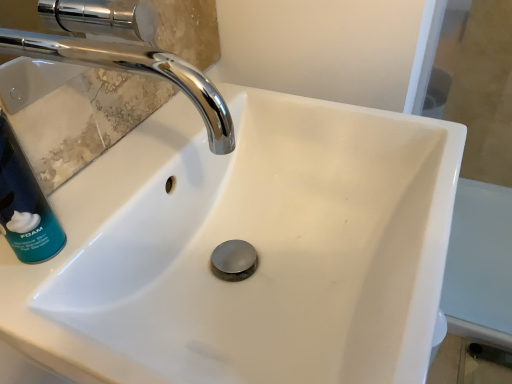
This screenshot has width=512, height=384. I want to click on teal matte shaving cream can at left, so click(x=25, y=205).

What do you see at coordinates (25, 205) in the screenshot? The image size is (512, 384). I see `teal matte shaving cream can at left` at bounding box center [25, 205].

The height and width of the screenshot is (384, 512). What do you see at coordinates (122, 53) in the screenshot?
I see `chrome/metallic faucet at upper left` at bounding box center [122, 53].

Where is `chrome/metallic faucet at upper left`? The height and width of the screenshot is (384, 512). chrome/metallic faucet at upper left is located at coordinates (122, 53).

What are the coordinates of `teal matte shaving cream can at left` in the screenshot? It's located at (25, 205).

Can you confirm if teal matte shaving cream can at left is positioned to the left of chrome/metallic faucet at upper left?

Indeed, teal matte shaving cream can at left is positioned on the left side of chrome/metallic faucet at upper left.

Considering the relative positions of teal matte shaving cream can at left and chrome/metallic faucet at upper left in the image provided, is teal matte shaving cream can at left in front of chrome/metallic faucet at upper left?

That is False.

Considering the points (11, 217) and (221, 122), which point is in front, point (11, 217) or point (221, 122)?

The point (11, 217) is closer to the camera.

From the image's perspective, which is above, teal matte shaving cream can at left or chrome/metallic faucet at upper left?

chrome/metallic faucet at upper left is shown above in the image.

From a real-world perspective, who is located higher, teal matte shaving cream can at left or chrome/metallic faucet at upper left?

chrome/metallic faucet at upper left, from a real-world perspective.

Considering the sizes of objects teal matte shaving cream can at left and chrome/metallic faucet at upper left in the image provided, who is thinner, teal matte shaving cream can at left or chrome/metallic faucet at upper left?

teal matte shaving cream can at left.

Can you confirm if teal matte shaving cream can at left is shorter than chrome/metallic faucet at upper left?

In fact, teal matte shaving cream can at left may be taller than chrome/metallic faucet at upper left.

Based on their sizes in the image, would you say teal matte shaving cream can at left is bigger or smaller than chrome/metallic faucet at upper left?

Clearly, teal matte shaving cream can at left is smaller in size than chrome/metallic faucet at upper left.

Does teal matte shaving cream can at left contain chrome/metallic faucet at upper left?

No, chrome/metallic faucet at upper left is not a part of teal matte shaving cream can at left.

Are teal matte shaving cream can at left and chrome/metallic faucet at upper left making contact?

No, teal matte shaving cream can at left is not with chrome/metallic faucet at upper left.

Is teal matte shaving cream can at left oriented away from chrome/metallic faucet at upper left?

teal matte shaving cream can at left is not turned away from chrome/metallic faucet at upper left.

Can you tell me how much teal matte shaving cream can at left and chrome/metallic faucet at upper left differ in facing direction?

The angle between the facing direction of teal matte shaving cream can at left and the facing direction of chrome/metallic faucet at upper left is 0.00787 degrees.

How much distance is there between teal matte shaving cream can at left and chrome/metallic faucet at upper left?

A distance of 15.31 inches exists between teal matte shaving cream can at left and chrome/metallic faucet at upper left.

Identify the location of tap above the teal matte shaving cream can at left (from a real-world perspective). This screenshot has width=512, height=384. (122, 53).

Between chrome/metallic faucet at upper left and teal matte shaving cream can at left, which one appears on the right side from the viewer's perspective?

chrome/metallic faucet at upper left.

Who is more distant, chrome/metallic faucet at upper left or teal matte shaving cream can at left?

teal matte shaving cream can at left is further away from the camera.

Considering the positions of points (87, 17) and (4, 143), is point (87, 17) farther from camera compared to point (4, 143)?

Yes, point (87, 17) is behind point (4, 143).

From the image's perspective, is chrome/metallic faucet at upper left positioned above or below teal matte shaving cream can at left?

Based on their image positions, chrome/metallic faucet at upper left is located above teal matte shaving cream can at left.

From a real-world perspective, is chrome/metallic faucet at upper left positioned under teal matte shaving cream can at left based on gravity?

Actually, chrome/metallic faucet at upper left is physically above teal matte shaving cream can at left in the real world.

Considering the sizes of objects chrome/metallic faucet at upper left and teal matte shaving cream can at left in the image provided, who is thinner, chrome/metallic faucet at upper left or teal matte shaving cream can at left?

With smaller width is teal matte shaving cream can at left.

From the picture: From their relative heights in the image, would you say chrome/metallic faucet at upper left is taller or shorter than teal matte shaving cream can at left?

Considering their sizes, chrome/metallic faucet at upper left has less height than teal matte shaving cream can at left.

Consider the image. Considering the sizes of objects chrome/metallic faucet at upper left and teal matte shaving cream can at left in the image provided, who is bigger, chrome/metallic faucet at upper left or teal matte shaving cream can at left?

With larger size is chrome/metallic faucet at upper left.

Is teal matte shaving cream can at left located within chrome/metallic faucet at upper left?

That's incorrect, teal matte shaving cream can at left is not inside chrome/metallic faucet at upper left.

Is chrome/metallic faucet at upper left far away from teal matte shaving cream can at left?

chrome/metallic faucet at upper left is actually quite close to teal matte shaving cream can at left.

Is teal matte shaving cream can at left at the back of chrome/metallic faucet at upper left?

chrome/metallic faucet at upper left does not have its back to teal matte shaving cream can at left.

Locate an element on the screen. This screenshot has width=512, height=384. cleaning product behind the chrome/metallic faucet at upper left is located at coordinates (25, 205).

At what (x,y) coordinates should I click in order to perform the action: click on cleaning product that appears below the chrome/metallic faucet at upper left (from the image's perspective). Please return your answer as a coordinate pair (x, y). This screenshot has height=384, width=512. Looking at the image, I should click on (25, 205).

The width and height of the screenshot is (512, 384). Identify the location of tap in front of the teal matte shaving cream can at left. (122, 53).